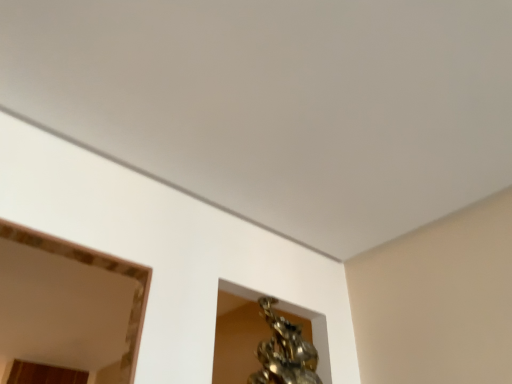
Question: Can you see shiny bronze statue at upper center touching matte gold mirror at upper left?

Choices:
 (A) yes
 (B) no

Answer: (B)

Question: From a real-world perspective, is shiny bronze statue at upper center physically below matte gold mirror at upper left?

Choices:
 (A) yes
 (B) no

Answer: (A)

Question: Is shiny bronze statue at upper center smaller than matte gold mirror at upper left?

Choices:
 (A) yes
 (B) no

Answer: (A)

Question: Is shiny bronze statue at upper center at the left side of matte gold mirror at upper left?

Choices:
 (A) yes
 (B) no

Answer: (B)

Question: From a real-world perspective, is shiny bronze statue at upper center on top of matte gold mirror at upper left?

Choices:
 (A) no
 (B) yes

Answer: (A)

Question: Can you confirm if shiny bronze statue at upper center is bigger than matte gold mirror at upper left?

Choices:
 (A) yes
 (B) no

Answer: (B)

Question: Considering the relative sizes of matte gold mirror at upper left and shiny bronze statue at upper center in the image provided, is matte gold mirror at upper left wider than shiny bronze statue at upper center?

Choices:
 (A) no
 (B) yes

Answer: (B)

Question: Is matte gold mirror at upper left far away from shiny bronze statue at upper center?

Choices:
 (A) yes
 (B) no

Answer: (B)

Question: Is matte gold mirror at upper left in contact with shiny bronze statue at upper center?

Choices:
 (A) yes
 (B) no

Answer: (B)

Question: Does matte gold mirror at upper left lie behind shiny bronze statue at upper center?

Choices:
 (A) no
 (B) yes

Answer: (B)

Question: Is matte gold mirror at upper left to the right of shiny bronze statue at upper center from the viewer's perspective?

Choices:
 (A) yes
 (B) no

Answer: (B)

Question: From a real-world perspective, is matte gold mirror at upper left located beneath shiny bronze statue at upper center?

Choices:
 (A) no
 (B) yes

Answer: (A)

Question: In terms of size, does matte gold mirror at upper left appear bigger or smaller than shiny bronze statue at upper center?

Choices:
 (A) small
 (B) big

Answer: (B)